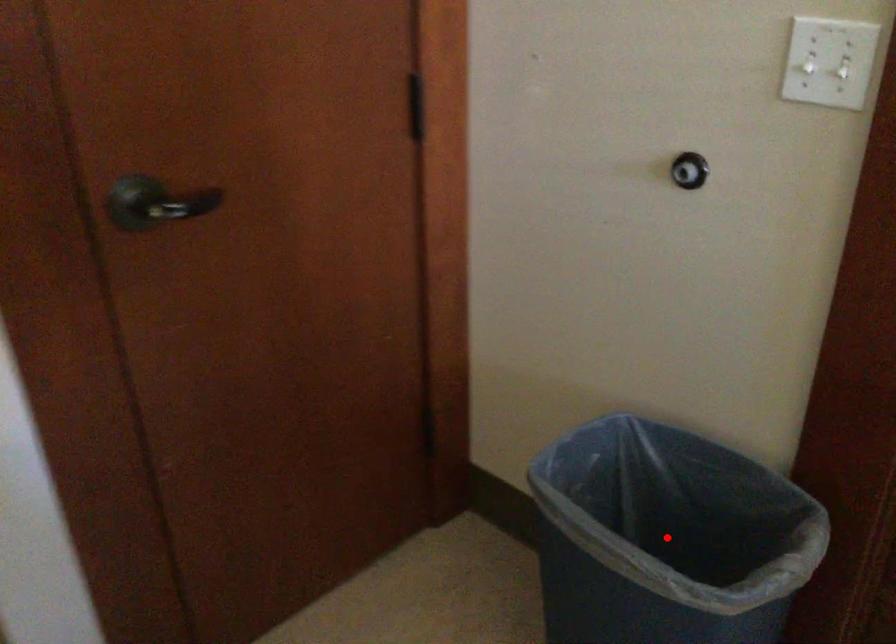
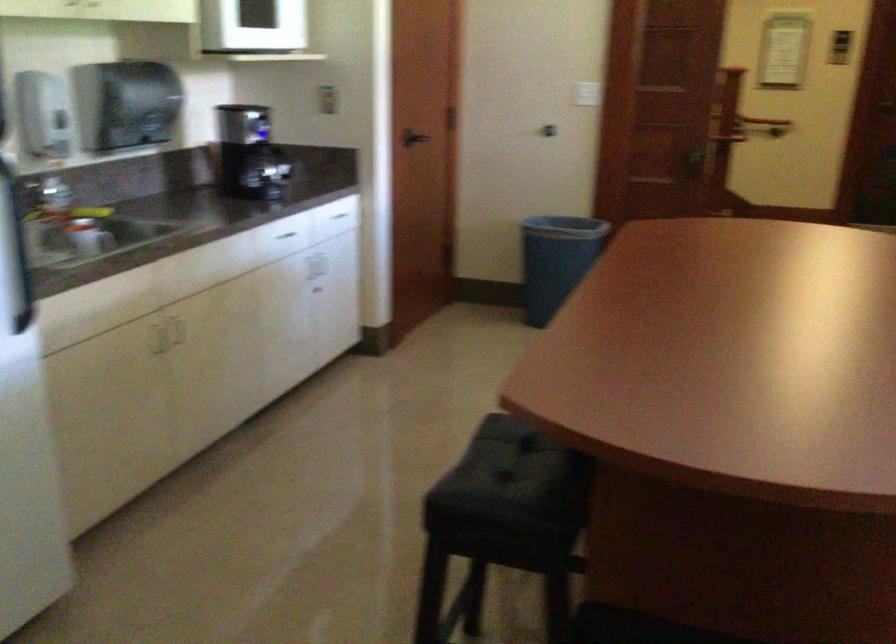
Question: I am providing you with two images of the same scene from different viewpoints. A red point is marked on the first image. At the location where the point appears in image 1, is it still visible in image 2?

Choices:
 (A) Yes
 (B) No

Answer: (B)